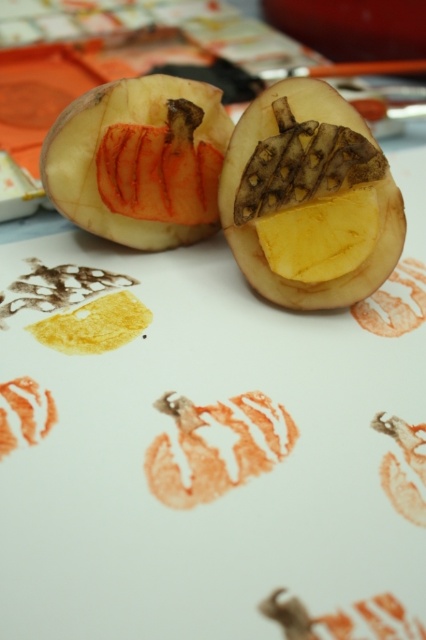
Is matte orange flesh at center closer to the viewer compared to orange rubber stamp at lower left?

No, matte orange flesh at center is further to the viewer.

Who is shorter, matte orange flesh at center or orange rubber stamp at lower left?

With less height is orange rubber stamp at lower left.

Between point (74, 202) and point (45, 426), which one is positioned behind?

Positioned behind is point (74, 202).

This screenshot has height=640, width=426. What are the coordinates of `matte orange flesh at center` in the screenshot? It's located at (140, 161).

Can you confirm if yellow matte potato at center is shorter than orange rubber stamp at center?

No, yellow matte potato at center is not shorter than orange rubber stamp at center.

Between point (291, 282) and point (209, 461), which one is positioned behind?

Positioned behind is point (291, 282).

At what (x,y) coordinates should I click in order to perform the action: click on yellow matte potato at center. Please return your answer as a coordinate pair (x, y). Looking at the image, I should click on (308, 198).

Locate an element on the screen. The image size is (426, 640). yellow matte potato at center is located at coordinates [x=308, y=198].

Measure the distance between brown textured potato at center and orange rubber stamp at lower left.

They are 51.22 centimeters apart.

Which is in front, point (385, 456) or point (51, 403)?

Point (385, 456) is in front.

The width and height of the screenshot is (426, 640). Identify the location of brown textured potato at center. (402, 490).